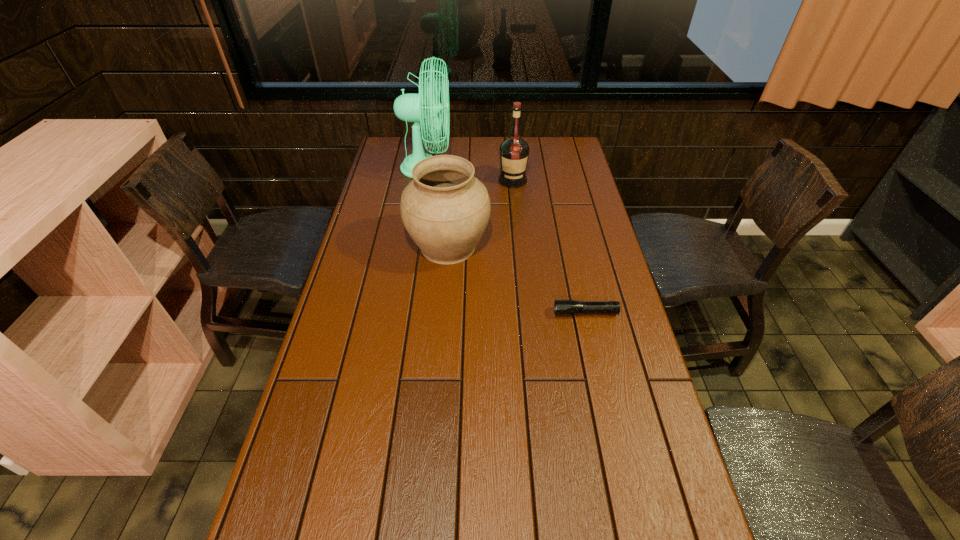
Where is `free space located at the lens end of the shortest object`? free space located at the lens end of the shortest object is located at coordinates (444, 313).

Where is `object at the far edge`? object at the far edge is located at coordinates (419, 108).

Find the location of `object present at the left edge`. object present at the left edge is located at coordinates (419, 108).

I want to click on object located in the right edge section of the desktop, so (561, 307).

The image size is (960, 540). Find the location of `object that is at the far left corner`. object that is at the far left corner is located at coordinates (419, 108).

This screenshot has width=960, height=540. What are the coordinates of `blank space at the far edge of the desktop` in the screenshot? It's located at (493, 148).

In the image, there is a desktop. Where is `free region at the left edge`? The width and height of the screenshot is (960, 540). free region at the left edge is located at coordinates (389, 176).

Where is `vacant space at the right edge`? The image size is (960, 540). vacant space at the right edge is located at coordinates (601, 250).

Where is `blank space at the far right corner of the desktop`? The height and width of the screenshot is (540, 960). blank space at the far right corner of the desktop is located at coordinates (570, 163).

I want to click on free space between the liquor and the flashlight, so click(x=549, y=247).